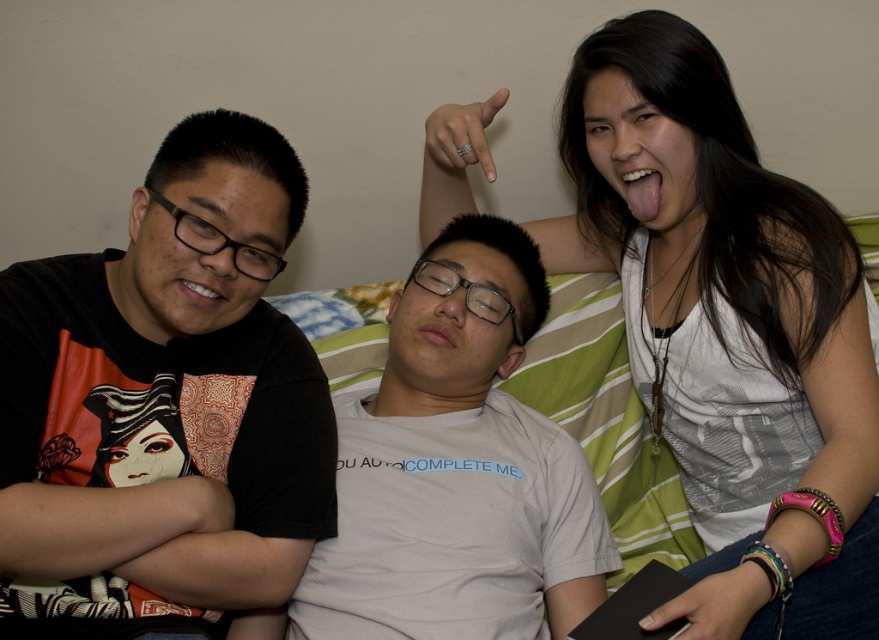
Question: Can you confirm if black matte t-shirt at left is smaller than white fabric at upper right?

Choices:
 (A) no
 (B) yes

Answer: (B)

Question: Can you confirm if black matte t-shirt at left is positioned below white fabric at upper right?

Choices:
 (A) yes
 (B) no

Answer: (A)

Question: Based on their relative distances, which object is nearer to the white fabric at upper right?

Choices:
 (A) white cotton t-shirt at center
 (B) black matte t-shirt at left

Answer: (A)

Question: Which of these objects is positioned farthest from the black matte t-shirt at left?

Choices:
 (A) white fabric at upper right
 (B) white cotton t-shirt at center

Answer: (A)

Question: Which object is farther from the camera taking this photo?

Choices:
 (A) white cotton t-shirt at center
 (B) black matte t-shirt at left

Answer: (A)

Question: Where is black matte t-shirt at left located in relation to white cotton t-shirt at center in the image?

Choices:
 (A) below
 (B) above

Answer: (B)